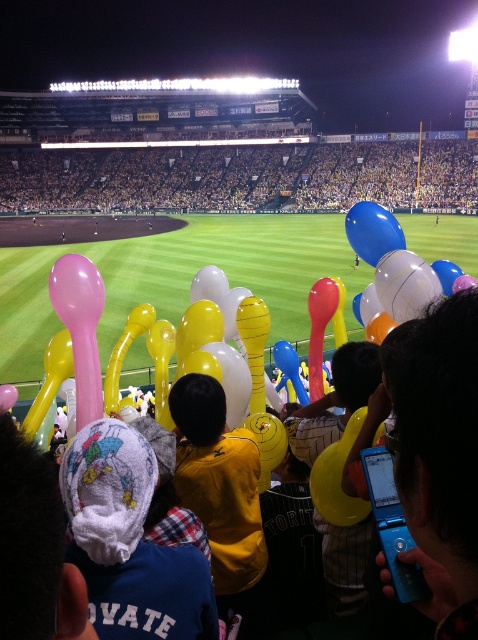
Is yellow balloon at center to the left of blue plastic flip phone at lower right from the viewer's perspective?

Correct, you'll find yellow balloon at center to the left of blue plastic flip phone at lower right.

Does yellow balloon at center have a lesser width compared to blue plastic flip phone at lower right?

No.

Is point (122, 148) farther from camera compared to point (412, 403)?

That is True.

The width and height of the screenshot is (478, 640). I want to click on yellow balloon at center, so click(x=208, y=177).

Does yellow matte shirt at center come in front of pink rubber spoon at center?

Yes, it is.

Is yellow matte shirt at center shorter than pink rubber spoon at center?

Incorrect, yellow matte shirt at center's height does not fall short of pink rubber spoon at center's.

Does point (191, 449) come closer to viewer compared to point (93, 312)?

That is True.

You are a GUI agent. You are given a task and a screenshot of the screen. Output one action in this format:
    pyautogui.click(x=<x>, y=<y>)
    Task: Click on the yellow matte shirt at center
    This screenshot has height=640, width=478.
    Given the screenshot: What is the action you would take?
    pyautogui.click(x=218, y=481)

Looking at this image, which is more to the right, yellow matte shirt at center or blue glossy balloon at center?

Positioned to the right is blue glossy balloon at center.

Is yellow matte shirt at center shorter than blue glossy balloon at center?

No.

Image resolution: width=478 pixels, height=640 pixels. I want to click on yellow matte shirt at center, so click(218, 481).